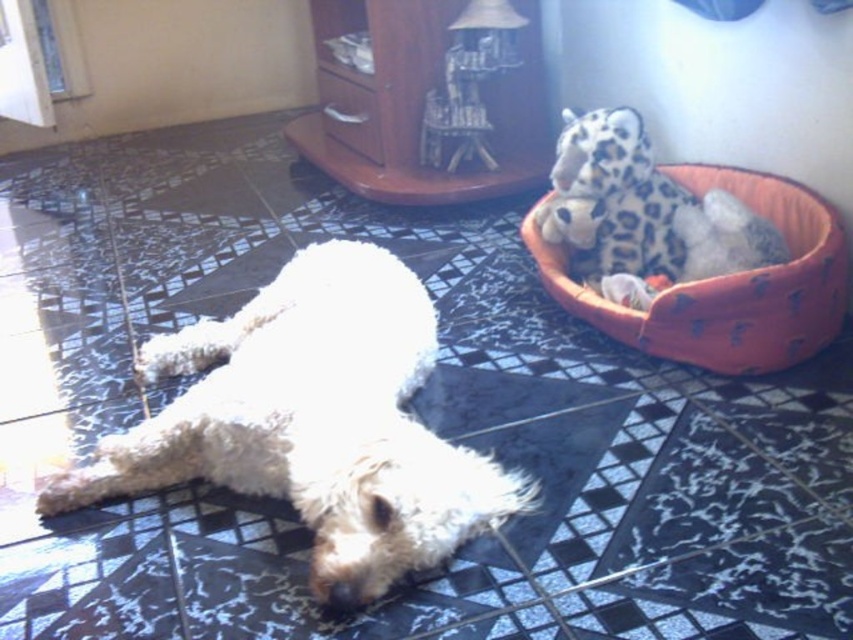
Question: Is the position of orange fabric dog bed at upper right more distant than that of spotted plush toy at upper right?

Choices:
 (A) yes
 (B) no

Answer: (B)

Question: From the image, what is the correct spatial relationship of orange fabric dog bed at upper right in relation to spotted plush toy at upper right?

Choices:
 (A) below
 (B) above

Answer: (A)

Question: Which point is closer to the camera taking this photo?

Choices:
 (A) (550, 220)
 (B) (415, 314)

Answer: (B)

Question: Which object appears closest to the camera in this image?

Choices:
 (A) spotted plush toy at upper right
 (B) white fluffy dog at center

Answer: (B)

Question: Is white fluffy dog at center to the left of spotted plush toy at upper right from the viewer's perspective?

Choices:
 (A) no
 (B) yes

Answer: (B)

Question: Which object is positioned farthest from the white fluffy dog at center?

Choices:
 (A) orange fabric dog bed at upper right
 (B) spotted plush toy at upper right

Answer: (A)